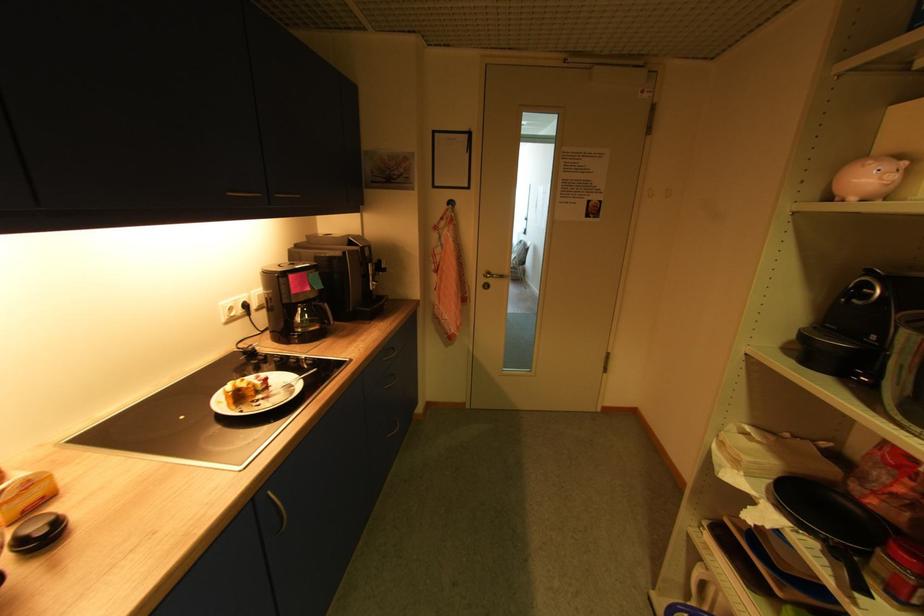
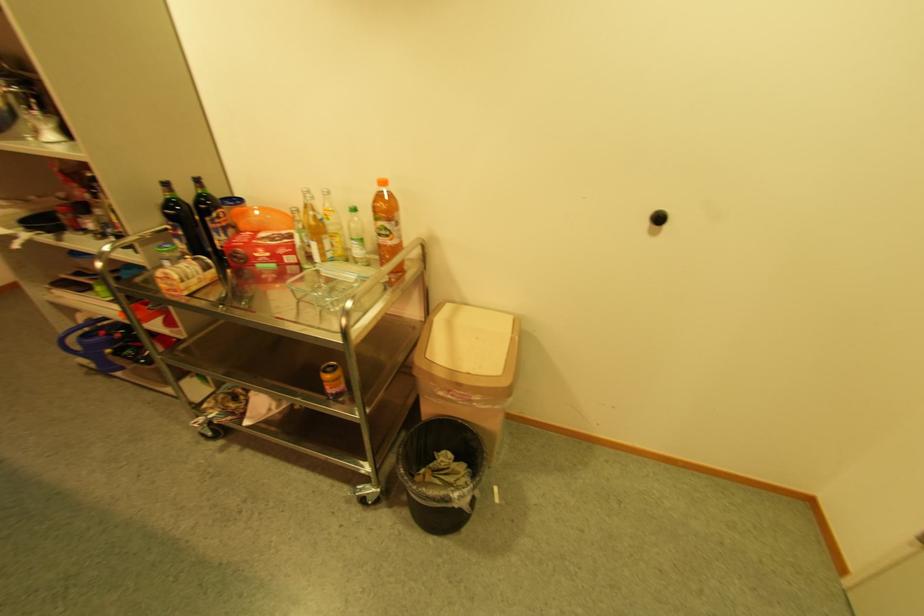
In the second image, find the point that corresponds to [709,578] in the first image.

(91, 320)